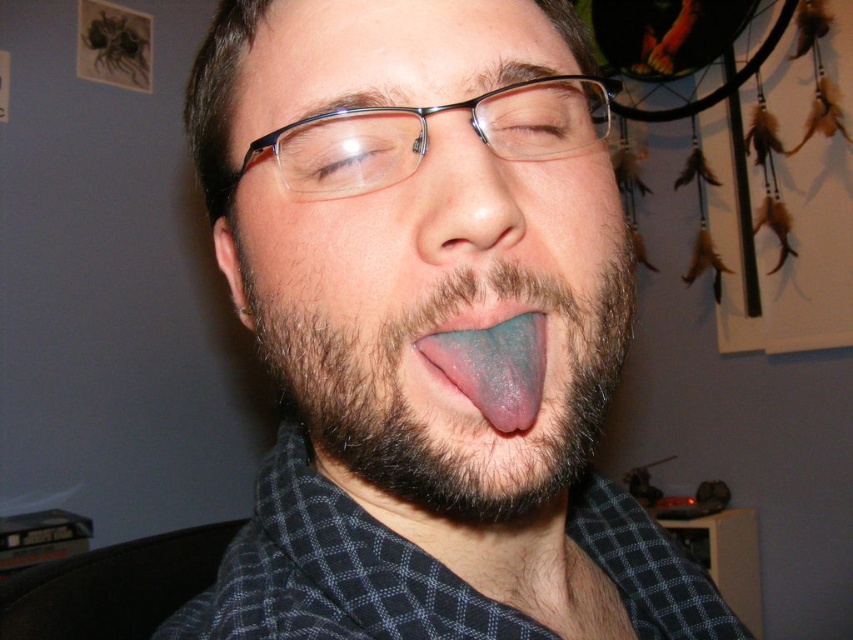
Does dark brown fuzzy beard at center have a greater width compared to blue glossy tongue at center?

Yes.

Between point (505, 273) and point (531, 358), which one is positioned behind?

Positioned behind is point (531, 358).

Locate an element on the screen. The image size is (853, 640). dark brown fuzzy beard at center is located at coordinates (453, 385).

Does matte blue tongue at center have a greater height compared to blue glossy tongue at center?

Indeed, matte blue tongue at center has a greater height compared to blue glossy tongue at center.

Between matte blue tongue at center and blue glossy tongue at center, which one is positioned lower?

Positioned lower is matte blue tongue at center.

Between point (363, 314) and point (473, 362), which one is positioned behind?

The point (363, 314) is behind.

This screenshot has width=853, height=640. I want to click on matte blue tongue at center, so click(425, 326).

Can you confirm if matte blue tongue at center is positioned to the left of dark brown fuzzy beard at center?

No, matte blue tongue at center is not to the left of dark brown fuzzy beard at center.

Which is below, matte blue tongue at center or dark brown fuzzy beard at center?

matte blue tongue at center is lower down.

Describe the element at coordinates (425, 326) in the screenshot. Image resolution: width=853 pixels, height=640 pixels. I see `matte blue tongue at center` at that location.

In order to click on matte blue tongue at center in this screenshot , I will do `click(425, 326)`.